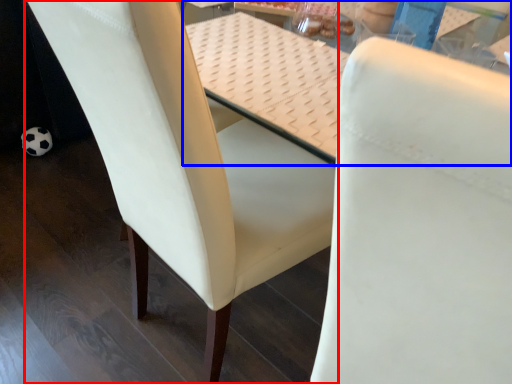
Question: Which of the following is the farthest to the observer, chair (highlighted by a red box) or table (highlighted by a blue box)?

Choices:
 (A) chair
 (B) table

Answer: (B)